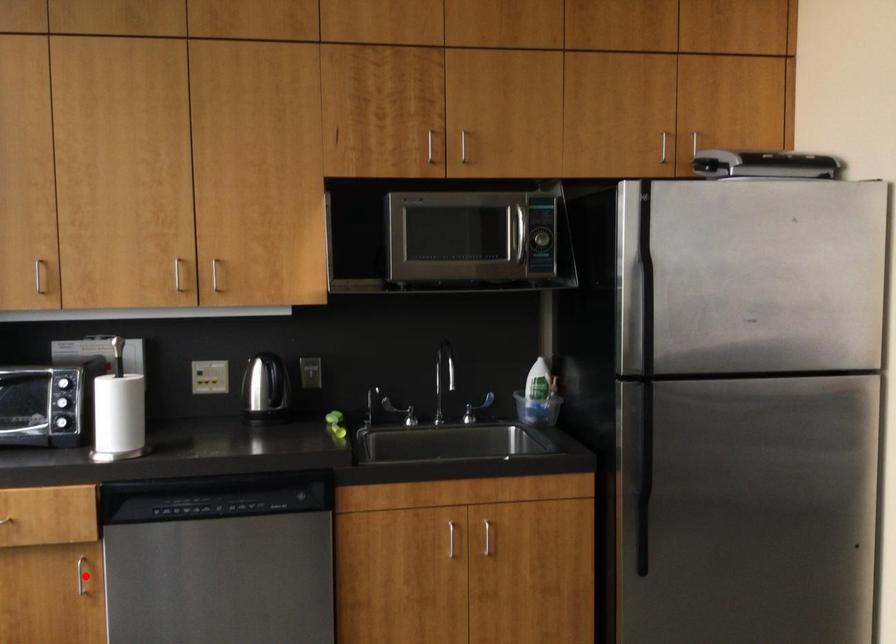
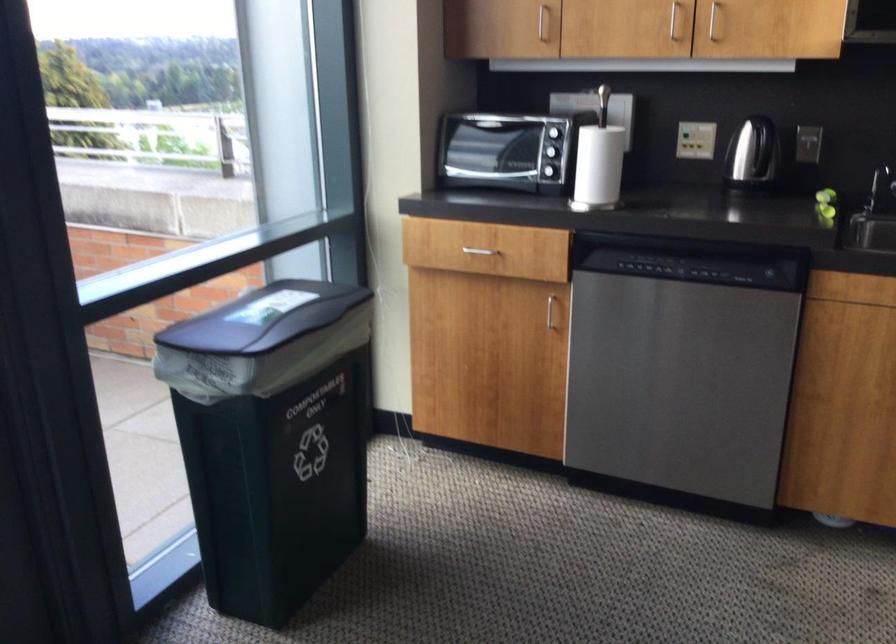
Find the pixel in the second image that matches the highlighted location in the first image.

(549, 310)